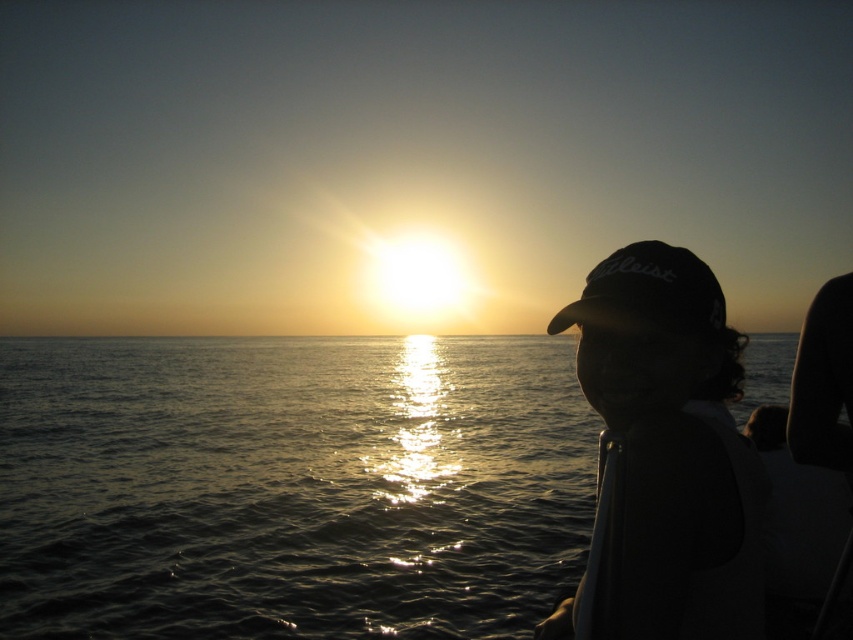
Question: Which object is farther from the camera taking this photo?

Choices:
 (A) black matte baseball cap at right
 (B) shiny reflective water at center

Answer: (B)

Question: Is shiny reflective water at center positioned in front of black matte baseball cap at right?

Choices:
 (A) yes
 (B) no

Answer: (B)

Question: Which point is closer to the camera?

Choices:
 (A) (199, 397)
 (B) (619, 364)

Answer: (B)

Question: Does shiny reflective water at center lie in front of black matte baseball cap at right?

Choices:
 (A) no
 (B) yes

Answer: (A)

Question: Which point is closer to the camera taking this photo?

Choices:
 (A) (503, 369)
 (B) (724, 353)

Answer: (B)

Question: Does shiny reflective water at center appear under black matte baseball cap at right?

Choices:
 (A) no
 (B) yes

Answer: (B)